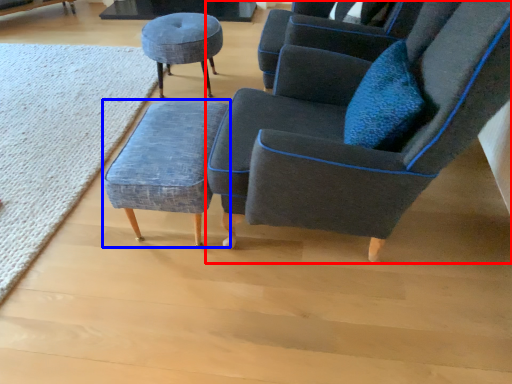
Question: Which point is further to the camera, chair (highlighted by a red box) or stool (highlighted by a blue box)?

Choices:
 (A) chair
 (B) stool

Answer: (B)